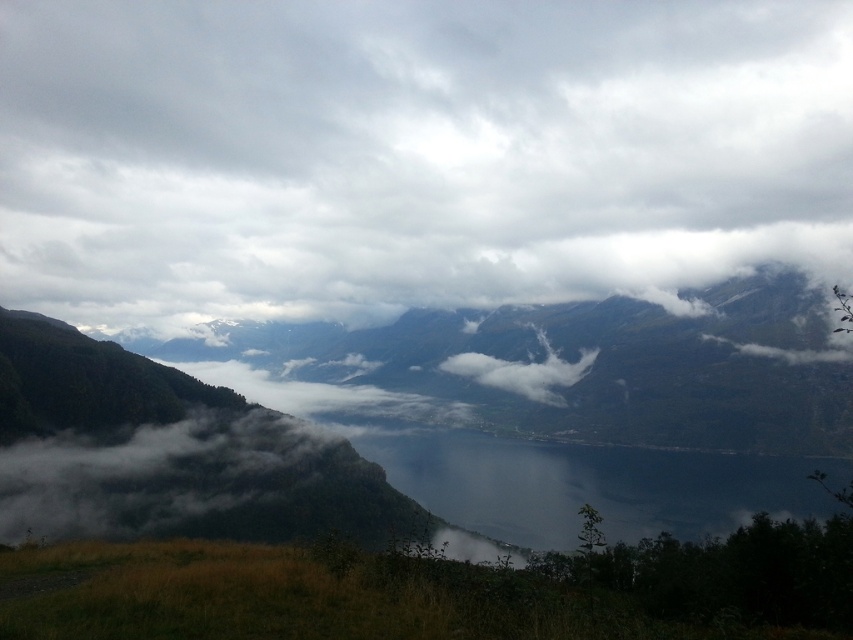
In the scene shown: Can you confirm if green grassy field at lower left is taller than green textured mountain at center?

No, green grassy field at lower left is not taller than green textured mountain at center.

Measure the distance between point (276,566) and camera.

Point (276,566) is 36.72 meters from camera.

Locate an element on the screen. The height and width of the screenshot is (640, 853). green grassy field at lower left is located at coordinates (434, 589).

Find the location of a particular element. Image resolution: width=853 pixels, height=640 pixels. green grassy field at lower left is located at coordinates (434, 589).

Which is more to the right, green textured mountain at center or dark blue water at center?

dark blue water at center

Is green textured mountain at center closer to camera compared to dark blue water at center?

No, it is behind dark blue water at center.

Where is `green textured mountain at center`? green textured mountain at center is located at coordinates (589, 365).

This screenshot has height=640, width=853. Find the location of `green textured mountain at center`. green textured mountain at center is located at coordinates (589, 365).

Between cloudy sky at upper center and green grassy field at lower left, which one is positioned lower?

green grassy field at lower left

Does point (62, 124) come farther from viewer compared to point (624, 612)?

That is True.

Is point (355, 70) farther from camera compared to point (770, 557)?

Yes.

Locate an element on the screen. cloudy sky at upper center is located at coordinates (412, 154).